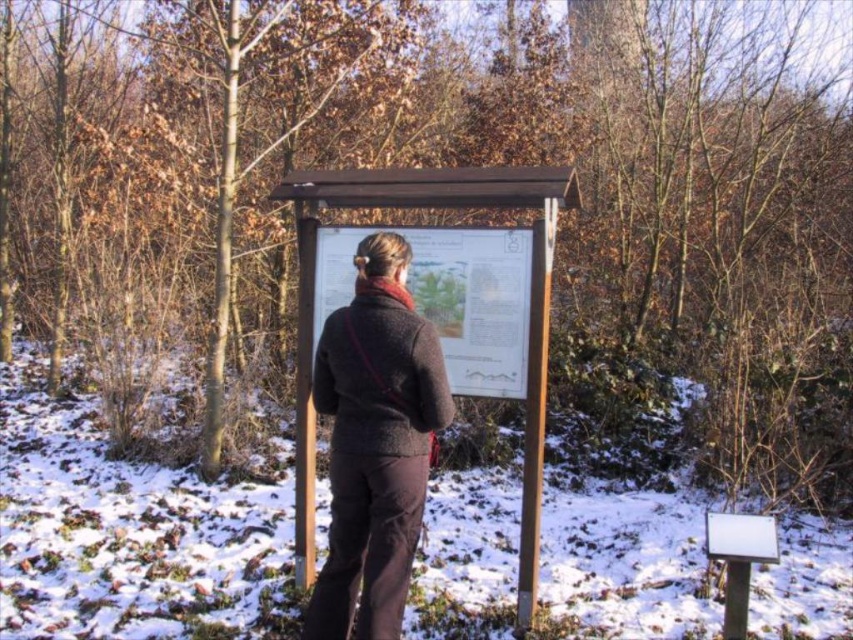
In the scene shown: You are a hiker who wants to place a small marker between the white powdery snow at center and the wooden sign at center. According to the scene description, which object should the marker be closer to?

The marker should be placed closer to the wooden sign at center because the white powdery snow at center is positioned on the left side of it.